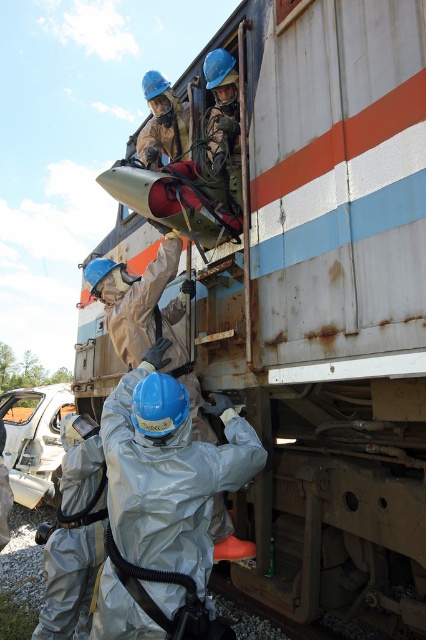
Question: Which of the following is the closest to the observer?

Choices:
 (A) matte black helmet at upper center
 (B) silver reflective suit at lower center
 (C) matte blue helmet at upper center

Answer: (B)

Question: Which is farther from the matte blue helmet at upper center?

Choices:
 (A) matte black helmet at upper center
 (B) silver reflective suit at lower center

Answer: (B)

Question: Is silver reflective suit at lower center wider than matte black helmet at upper center?

Choices:
 (A) no
 (B) yes

Answer: (B)

Question: Considering the real-world distances, which object is closest to the matte black helmet at upper center?

Choices:
 (A) silver reflective suit at lower center
 (B) matte blue helmet at upper center

Answer: (B)

Question: Is the position of silver reflective suit at lower center less distant than that of matte black helmet at upper center?

Choices:
 (A) no
 (B) yes

Answer: (B)

Question: Can you confirm if silver reflective suit at lower center is positioned to the right of matte black helmet at upper center?

Choices:
 (A) no
 (B) yes

Answer: (A)